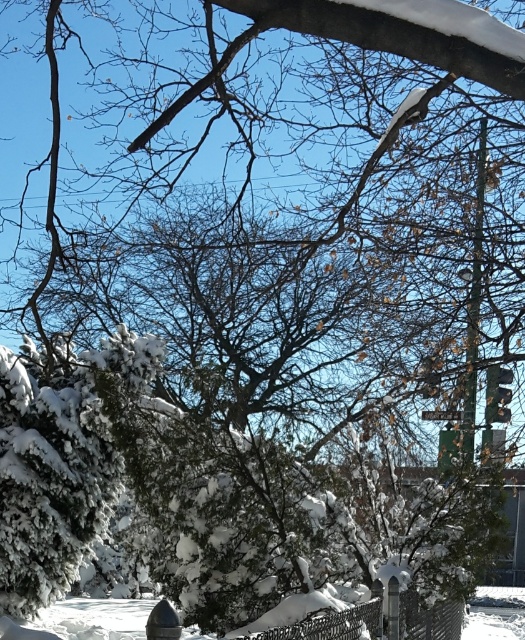
Question: Can you confirm if metallic wire fence at lower center is thinner than shiny metallic hydrant at lower center?

Choices:
 (A) yes
 (B) no

Answer: (A)

Question: Which of the following is the farthest from the observer?

Choices:
 (A) (151, 632)
 (B) (349, 634)

Answer: (B)

Question: Observing the image, what is the correct spatial positioning of green metallic pole at upper right in reference to shiny metallic hydrant at lower center?

Choices:
 (A) right
 (B) left

Answer: (A)

Question: Which object is closer to the camera taking this photo?

Choices:
 (A) shiny metallic hydrant at lower center
 (B) green metallic pole at upper right

Answer: (A)

Question: Which object appears closest to the camera in this image?

Choices:
 (A) shiny metallic hydrant at lower center
 (B) green metallic pole at upper right

Answer: (A)

Question: Can you confirm if green metallic pole at upper right is positioned to the right of shiny metallic hydrant at lower center?

Choices:
 (A) no
 (B) yes

Answer: (B)